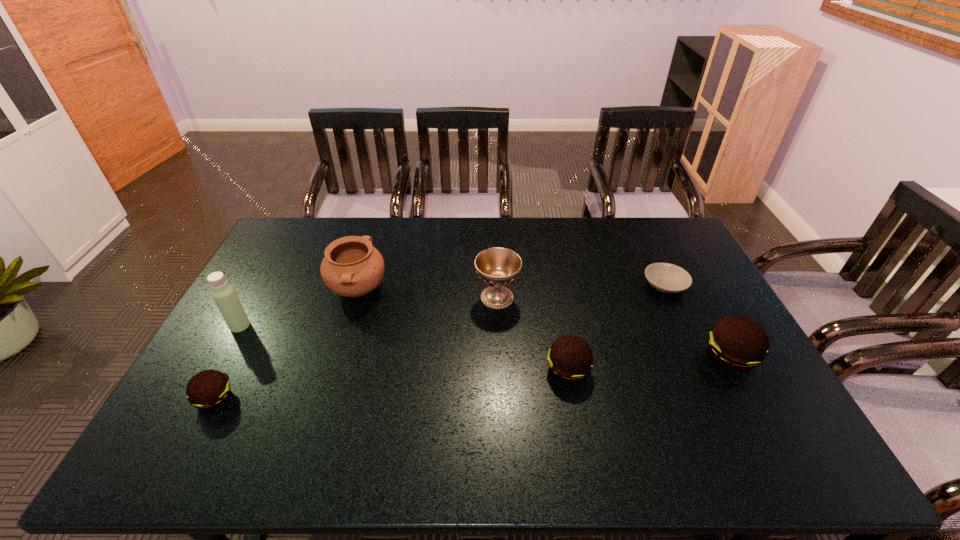
At what (x,y) coordinates should I click in order to perform the action: click on the sixth tallest object. Please return your answer as a coordinate pair (x, y). Looking at the image, I should click on (209, 389).

In order to click on the shortest patty in this screenshot , I will do [x=209, y=389].

Image resolution: width=960 pixels, height=540 pixels. In order to click on the fifth object from left to right in this screenshot , I will do `click(570, 358)`.

You are a GUI agent. You are given a task and a screenshot of the screen. Output one action in this format:
    pyautogui.click(x=<x>, y=<y>)
    Task: Click on the third shortest object
    Image resolution: width=960 pixels, height=540 pixels.
    Given the screenshot: What is the action you would take?
    pyautogui.click(x=570, y=358)

Locate an element on the screen. This screenshot has height=540, width=960. the fourth shortest object is located at coordinates (x=736, y=343).

Locate an element on the screen. the tallest patty is located at coordinates (736, 343).

You are a GUI agent. You are given a task and a screenshot of the screen. Output one action in this format:
    pyautogui.click(x=<x>, y=<y>)
    Task: Click on the shortest object
    This screenshot has width=960, height=540.
    Given the screenshot: What is the action you would take?
    pyautogui.click(x=669, y=278)

Locate an element on the screen. Image resolution: width=960 pixels, height=540 pixels. pottery is located at coordinates (352, 267).

I want to click on chalice, so click(x=498, y=267).

The image size is (960, 540). Identify the location of the tallest object. (223, 293).